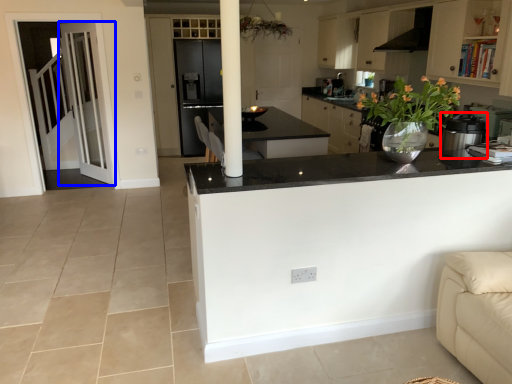
Question: Which of the following is the farthest to the observer, kitchen appliance (highlighted by a red box) or door (highlighted by a blue box)?

Choices:
 (A) kitchen appliance
 (B) door

Answer: (B)